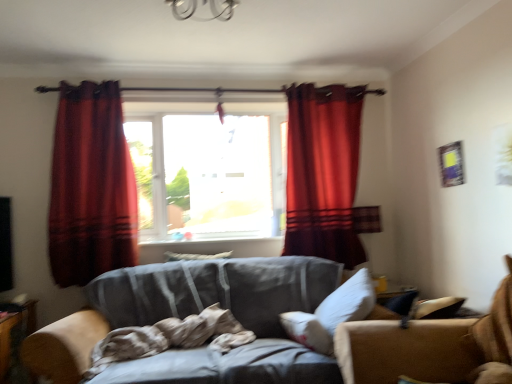
Question: Visually, is gray fabric couch at center positioned to the left or to the right of velvet red curtain at center, which appears as the 1th curtain when viewed from the right?

Choices:
 (A) left
 (B) right

Answer: (A)

Question: Considering the positions of point (479, 360) and point (351, 193), is point (479, 360) closer or farther from the camera than point (351, 193)?

Choices:
 (A) farther
 (B) closer

Answer: (B)

Question: Which object is positioned farthest from the velvet red curtain at center, which appears as the 1th curtain when viewed from the right?

Choices:
 (A) velvet red curtain at left, the 2th curtain in the right-to-left sequence
 (B) white soft pillow at center, the second pillow viewed from the top
 (C) transparent glass window at center
 (D) white soft pillow at center, marked as the 1th pillow in a back-to-front arrangement
 (E) gray fabric couch at center

Answer: (A)

Question: Estimate the real-world distances between objects in this image. Which object is closer to the velvet red curtain at left, arranged as the first curtain when viewed from the left?

Choices:
 (A) transparent glass window at center
 (B) white soft pillow at center, the 1th pillow from the top
 (C) velvet red curtain at center, positioned as the 2th curtain in left-to-right order
 (D) white soft pillow at center, the second pillow viewed from the top
 (E) gray fabric couch at center

Answer: (A)